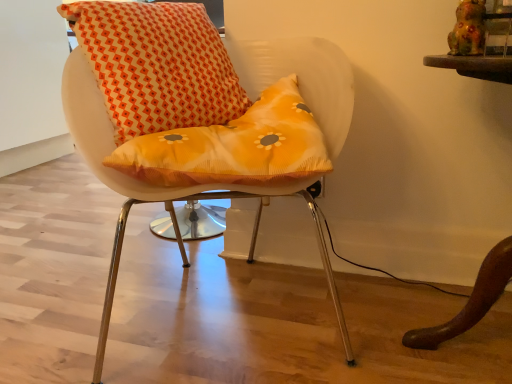
Question: Considering the relative sizes of orange printed cushion at center and matte white chair at center in the image provided, is orange printed cushion at center bigger than matte white chair at center?

Choices:
 (A) no
 (B) yes

Answer: (A)

Question: Is orange printed cushion at center not within matte white chair at center?

Choices:
 (A) yes
 (B) no

Answer: (B)

Question: Is orange printed cushion at center facing away from matte white chair at center?

Choices:
 (A) yes
 (B) no

Answer: (A)

Question: Considering the relative positions of orange printed cushion at center and matte white chair at center in the image provided, is orange printed cushion at center to the left of matte white chair at center from the viewer's perspective?

Choices:
 (A) no
 (B) yes

Answer: (B)

Question: From the image's perspective, is orange printed cushion at center on top of matte white chair at center?

Choices:
 (A) no
 (B) yes

Answer: (B)

Question: From the image's perspective, would you say orange printed cushion at center is shown under matte white chair at center?

Choices:
 (A) no
 (B) yes

Answer: (A)

Question: Is matte white chair at center at the left side of orange printed cushion at center?

Choices:
 (A) yes
 (B) no

Answer: (B)

Question: From a real-world perspective, does matte white chair at center sit lower than orange printed cushion at center?

Choices:
 (A) no
 (B) yes

Answer: (B)

Question: Would you say matte white chair at center is a long distance from orange printed cushion at center?

Choices:
 (A) no
 (B) yes

Answer: (A)

Question: Is matte white chair at center to the right of orange printed cushion at center from the viewer's perspective?

Choices:
 (A) no
 (B) yes

Answer: (B)

Question: Could you tell me if matte white chair at center is turned towards orange printed cushion at center?

Choices:
 (A) yes
 (B) no

Answer: (B)

Question: Considering the relative sizes of matte white chair at center and orange printed cushion at center in the image provided, is matte white chair at center thinner than orange printed cushion at center?

Choices:
 (A) yes
 (B) no

Answer: (B)

Question: Considering the positions of orange printed cushion at center and matte white chair at center in the image, is orange printed cushion at center wider or thinner than matte white chair at center?

Choices:
 (A) wide
 (B) thin

Answer: (B)